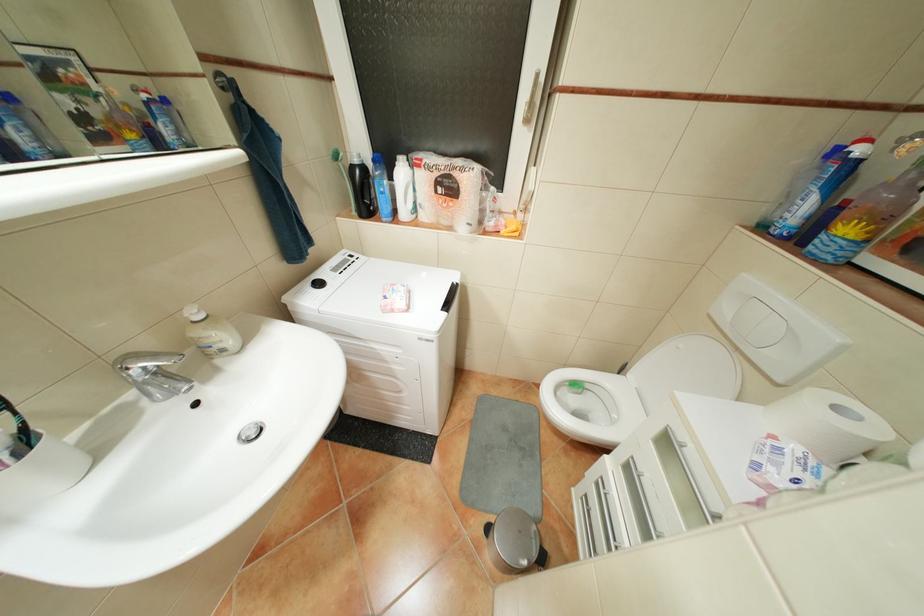
Where would you press the toilet flush button? Please return your answer as a coordinate pair (x, y).

(773, 331)